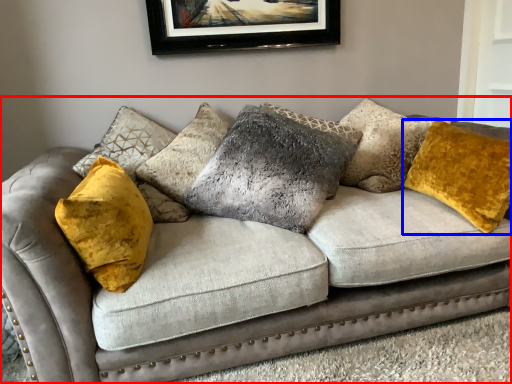
Question: Among these objects, which one is nearest to the camera, studio couch (highlighted by a red box) or pillow (highlighted by a blue box)?

Choices:
 (A) studio couch
 (B) pillow

Answer: (A)